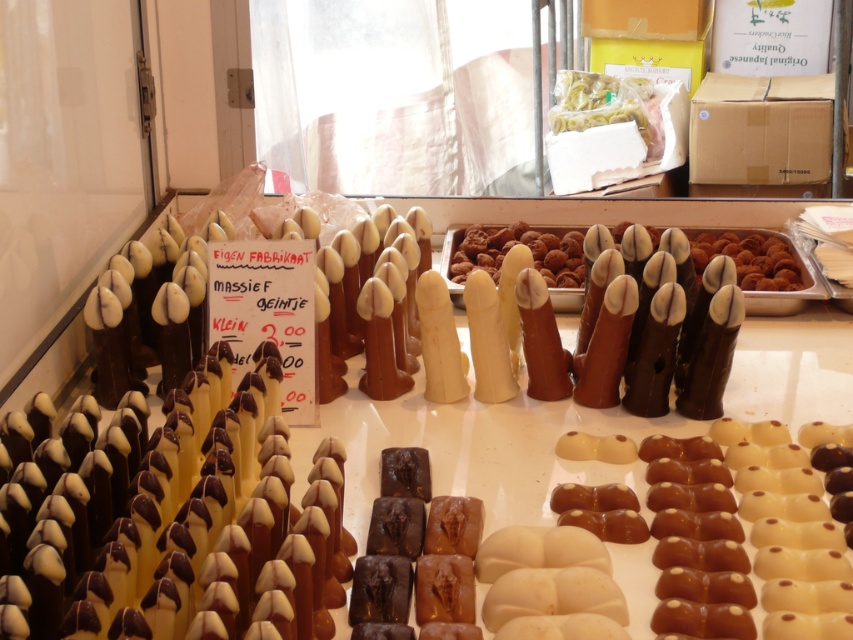
You are a customer at a chocolate shop and see the brown chocolate finger at center and the yellow matte pasta at center. Which one is bigger?

The brown chocolate finger at center is larger than the yellow matte pasta at center.

You are a customer at a chocolate shop and see the brown chocolate finger at center and the yellow matte pasta at center on the display. Which item is positioned lower on the display?

The brown chocolate finger at center is positioned lower because it is below the yellow matte pasta at center.